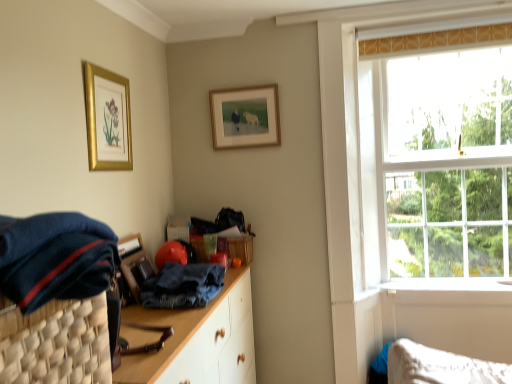
Where is `empty space that is ontop of denim at center, which is the 1th clothing in bottom-to-top order (from a real-world perspective)`? Image resolution: width=512 pixels, height=384 pixels. empty space that is ontop of denim at center, which is the 1th clothing in bottom-to-top order (from a real-world perspective) is located at coordinates (185, 270).